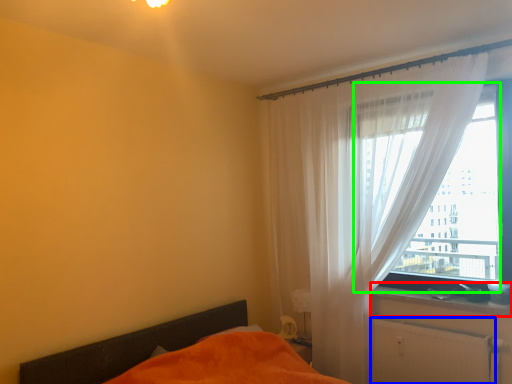
Question: Considering the real-world distances, which object is closest to window sill (highlighted by a red box)? radiator (highlighted by a blue box) or window (highlighted by a green box).

Choices:
 (A) radiator
 (B) window

Answer: (A)